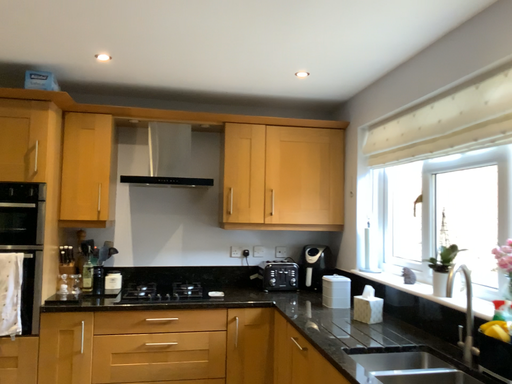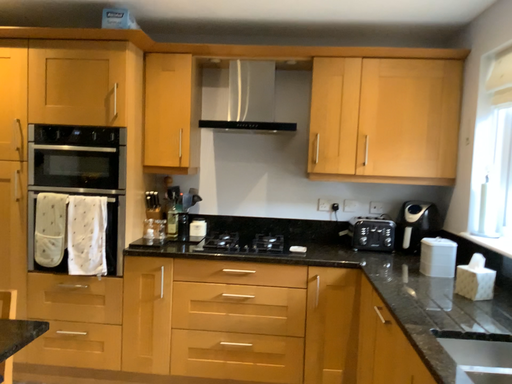
Question: Which way did the camera rotate in the video?

Choices:
 (A) rotated left
 (B) rotated right

Answer: (A)